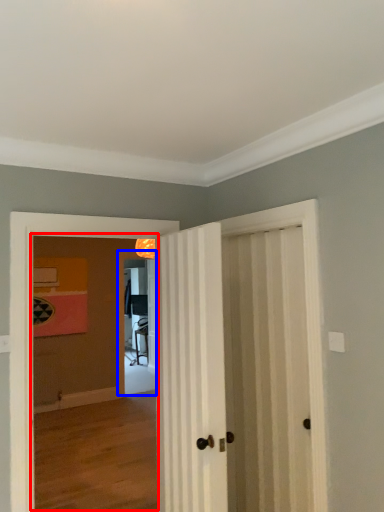
Question: Which of the following is the closest to the observer, corridor (highlighted by a red box) or screen door (highlighted by a blue box)?

Choices:
 (A) corridor
 (B) screen door

Answer: (A)